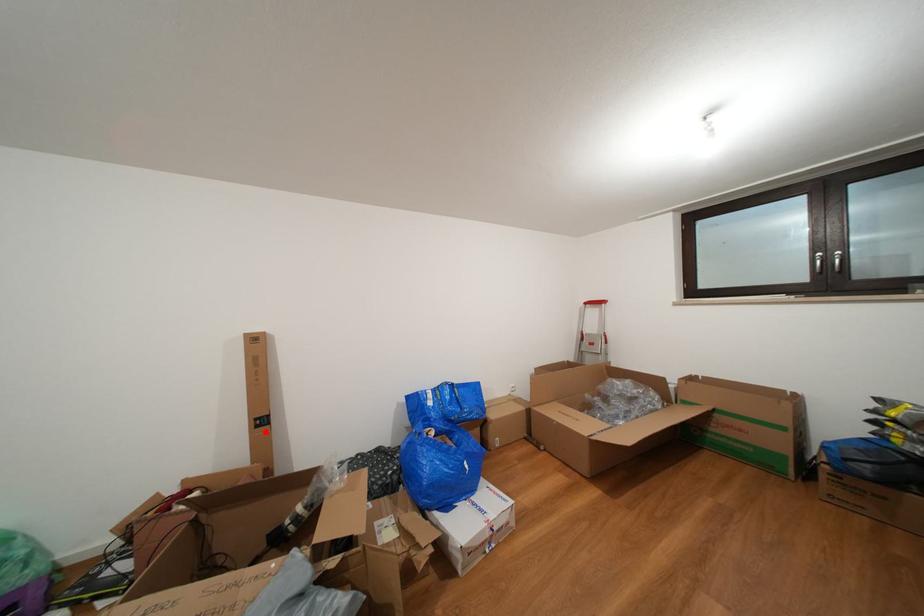
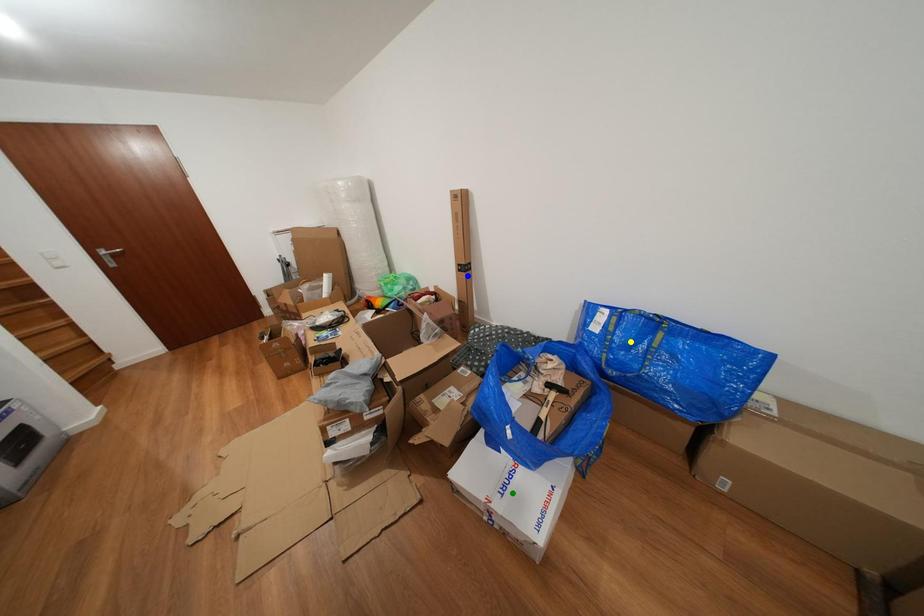
Question: I am providing you with two images of the same scene from different viewpoints. A red point is marked on the first image. You are given multiple points on the second image. In image 2, which mark is for the same physical point as the one in image 1?

Choices:
 (A) green point
 (B) yellow point
 (C) blue point

Answer: (C)